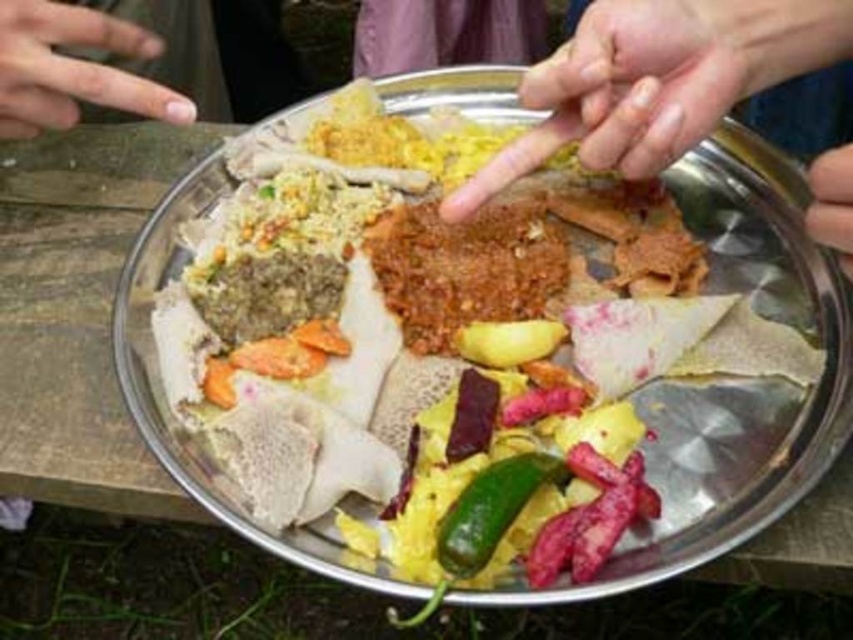
Looking at the image of the traditional Indian meal on the tray, you notice a smooth skin hand at upper right and a nail polish at upper left. Which object is positioned to the right of the other?

The smooth skin hand at upper right is positioned to the right of the nail polish at upper left.

You are holding the smooth skin hand at upper right and want to pick up the green matte pepper at center. Considering their sizes, will the hand easily cover the pepper?

The smooth skin hand at upper right is larger than the green matte pepper at center, so yes, the hand can easily cover the pepper.